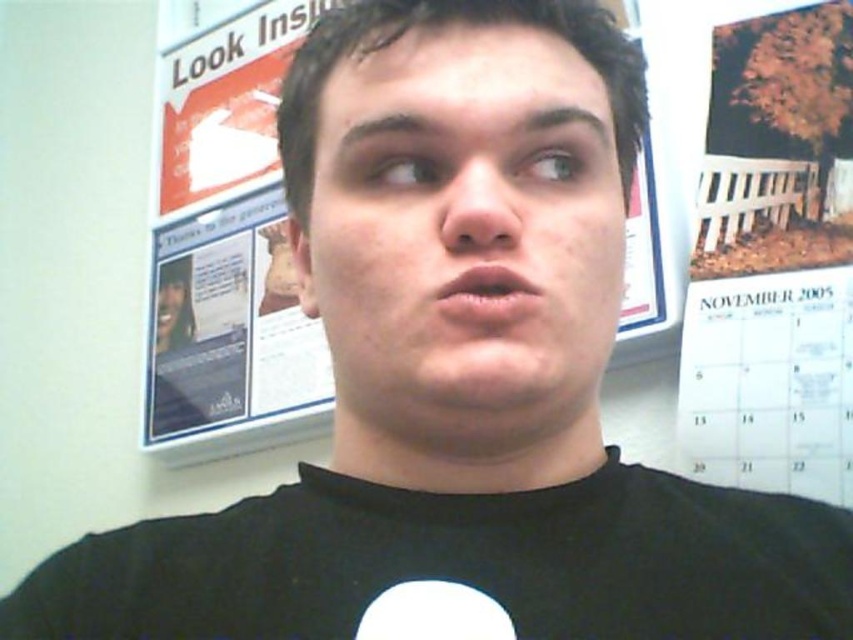
Which is behind, point (543, 400) or point (746, 600)?

The point (746, 600) is behind.

Is smooth skin face at center to the left of black matte t-shirt at center from the viewer's perspective?

Indeed, smooth skin face at center is positioned on the left side of black matte t-shirt at center.

Is point (550, 144) in front of point (222, 536)?

That is True.

Where is `smooth skin face at center`? This screenshot has height=640, width=853. smooth skin face at center is located at coordinates (463, 227).